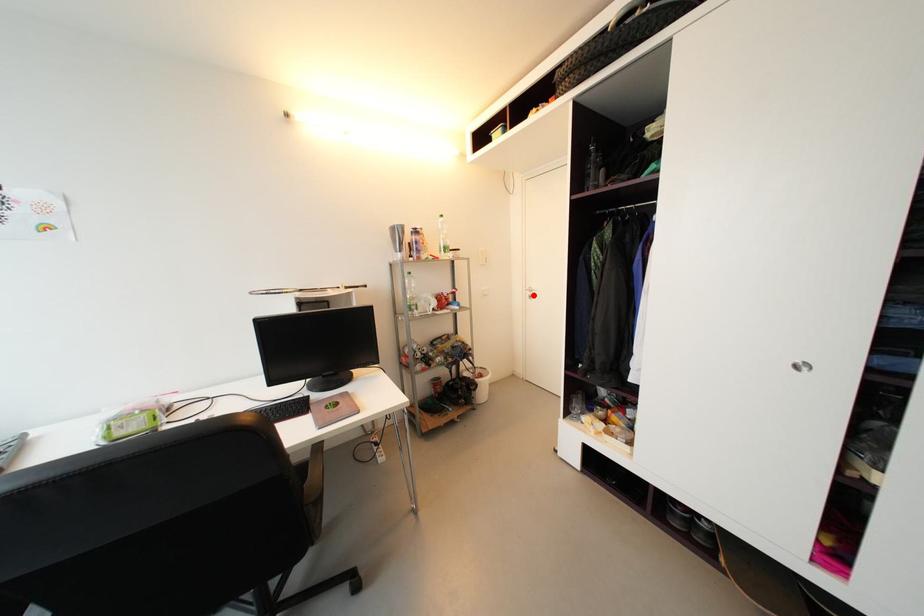
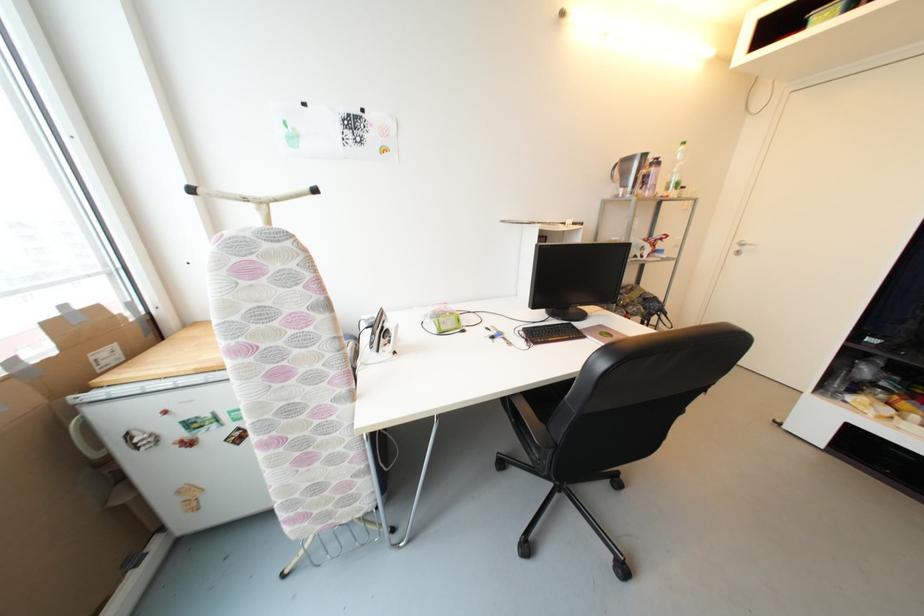
Where in the second image is the point corresponding to the highlighted location from the first image?

(742, 249)